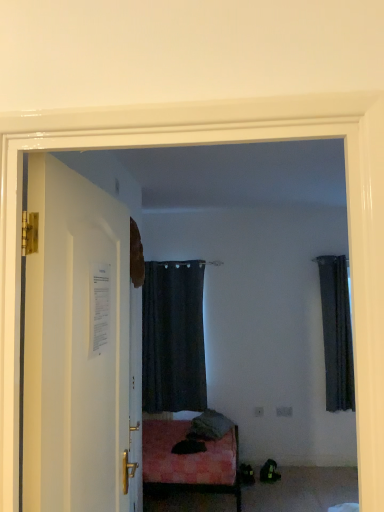
Question: Is there a large distance between dark fabric curtain at right, the 2th curtain in the left-to-right sequence, and black fabric curtain at center, which is the 2th curtain in right-to-left order?

Choices:
 (A) no
 (B) yes

Answer: (B)

Question: Can you confirm if dark fabric curtain at right, marked as the first curtain in a right-to-left arrangement, is smaller than black fabric curtain at center, acting as the first curtain starting from the left?

Choices:
 (A) yes
 (B) no

Answer: (A)

Question: Does dark fabric curtain at right, the 2th curtain in the left-to-right sequence, have a lesser width compared to black fabric curtain at center, which is the 2th curtain in right-to-left order?

Choices:
 (A) no
 (B) yes

Answer: (B)

Question: Does dark fabric curtain at right, marked as the first curtain in a right-to-left arrangement, appear on the left side of black fabric curtain at center, acting as the first curtain starting from the left?

Choices:
 (A) no
 (B) yes

Answer: (A)

Question: From the image's perspective, does dark fabric curtain at right, marked as the first curtain in a right-to-left arrangement, appear higher than black fabric curtain at center, acting as the first curtain starting from the left?

Choices:
 (A) no
 (B) yes

Answer: (B)

Question: In the image, is dark fabric curtain at right, the 2th curtain in the left-to-right sequence, positioned in front of or behind black fabric curtain at center, which is the 2th curtain in right-to-left order?

Choices:
 (A) behind
 (B) front

Answer: (B)

Question: Would you say dark fabric curtain at right, marked as the first curtain in a right-to-left arrangement, is inside or outside black fabric curtain at center, which is the 2th curtain in right-to-left order?

Choices:
 (A) inside
 (B) outside

Answer: (B)

Question: Looking at their shapes, would you say dark fabric curtain at right, the 2th curtain in the left-to-right sequence, is wider or thinner than black fabric curtain at center, acting as the first curtain starting from the left?

Choices:
 (A) thin
 (B) wide

Answer: (A)

Question: Visually, is dark fabric curtain at right, the 2th curtain in the left-to-right sequence, positioned to the left or to the right of black fabric curtain at center, which is the 2th curtain in right-to-left order?

Choices:
 (A) right
 (B) left

Answer: (A)

Question: Which is correct: white glossy door at left is inside dark fabric curtain at right, the 2th curtain in the left-to-right sequence, or outside of it?

Choices:
 (A) outside
 (B) inside

Answer: (A)

Question: From the image's perspective, relative to dark fabric curtain at right, marked as the first curtain in a right-to-left arrangement, is white glossy door at left above or below?

Choices:
 (A) below
 (B) above

Answer: (B)

Question: Is white glossy door at left wider or thinner than dark fabric curtain at right, the 2th curtain in the left-to-right sequence?

Choices:
 (A) thin
 (B) wide

Answer: (A)

Question: Is white glossy door at left bigger or smaller than dark fabric curtain at right, marked as the first curtain in a right-to-left arrangement?

Choices:
 (A) small
 (B) big

Answer: (B)

Question: Looking at their shapes, would you say black fabric curtain at center, which is the 2th curtain in right-to-left order, is wider or thinner than dark fabric curtain at right, the 2th curtain in the left-to-right sequence?

Choices:
 (A) thin
 (B) wide

Answer: (B)

Question: From the image's perspective, is black fabric curtain at center, acting as the first curtain starting from the left, positioned above or below dark fabric curtain at right, marked as the first curtain in a right-to-left arrangement?

Choices:
 (A) below
 (B) above

Answer: (A)